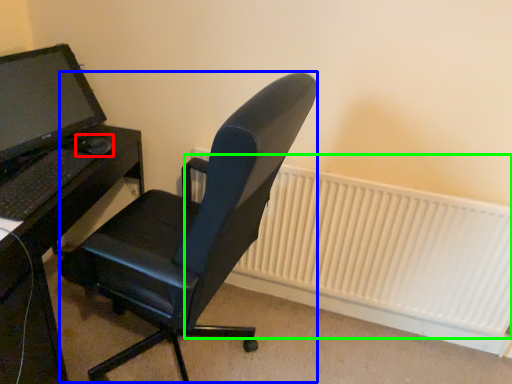
Question: Which object is the closest to the mouse (highlighted by a red box)? Choose among these: computer chair (highlighted by a blue box) or radiator (highlighted by a green box).

Choices:
 (A) computer chair
 (B) radiator

Answer: (A)